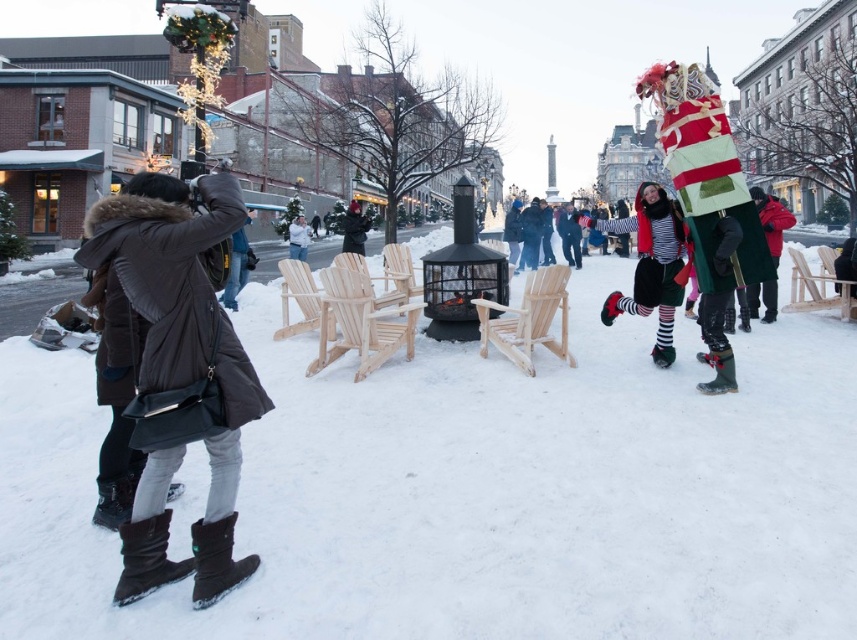
Question: Which object is farther from the camera taking this photo?

Choices:
 (A) dark brown fur-lined coat at left
 (B) light wood chair at center

Answer: (B)

Question: Can you confirm if striped fabric costume at right is thinner than natural wood chair at center?

Choices:
 (A) no
 (B) yes

Answer: (A)

Question: Which point is closer to the camera taking this photo?

Choices:
 (A) (355, 248)
 (B) (832, 292)

Answer: (B)

Question: Is dark brown fur-lined coat at left smaller than light brown wood chairs at center?

Choices:
 (A) no
 (B) yes

Answer: (A)

Question: Is light brown wood chairs at center smaller than light wood chair at center?

Choices:
 (A) no
 (B) yes

Answer: (A)

Question: Which object appears closest to the camera in this image?

Choices:
 (A) light brown wood chairs at center
 (B) striped fabric costume at right
 (C) light wood chair at center
 (D) natural wood chair at center

Answer: (A)